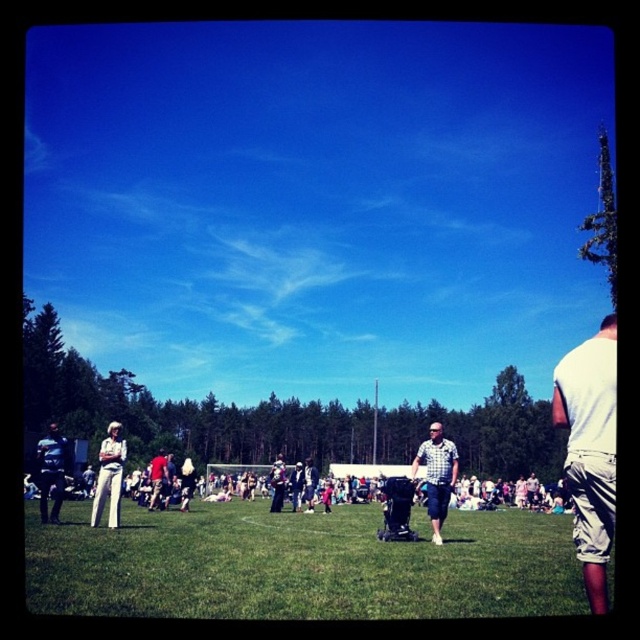
Question: Among these points, which one is farthest from the camera?

Choices:
 (A) (61, 499)
 (B) (28, 540)
 (C) (442, 456)
 (D) (612, 460)

Answer: (A)

Question: Does green grass at center have a lesser width compared to white cotton shirt at right?

Choices:
 (A) no
 (B) yes

Answer: (B)

Question: Can you confirm if green grass at center is positioned to the left of dark blue shirt at lower left?

Choices:
 (A) no
 (B) yes

Answer: (A)

Question: Which point is closer to the camera?

Choices:
 (A) pos(429,452)
 (B) pos(595,396)
 (C) pos(164,477)
 (D) pos(99,518)

Answer: (B)

Question: Can you confirm if green grass at center is positioned to the left of checkered shirt at center?

Choices:
 (A) no
 (B) yes

Answer: (B)

Question: Which of the following is the closest to the observer?

Choices:
 (A) dark blue shirt at lower left
 (B) white cotton pants at lower left
 (C) green grass at center

Answer: (C)